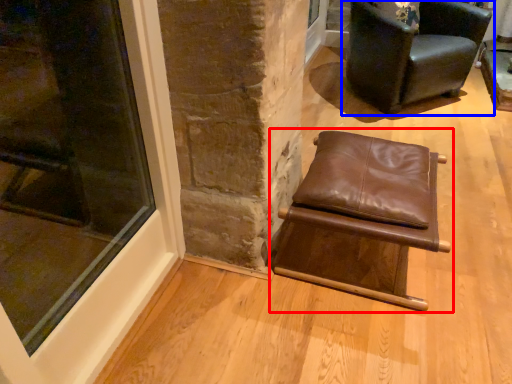
Question: Which object appears farthest to the camera in this image, chair (highlighted by a red box) or chair (highlighted by a blue box)?

Choices:
 (A) chair
 (B) chair

Answer: (B)